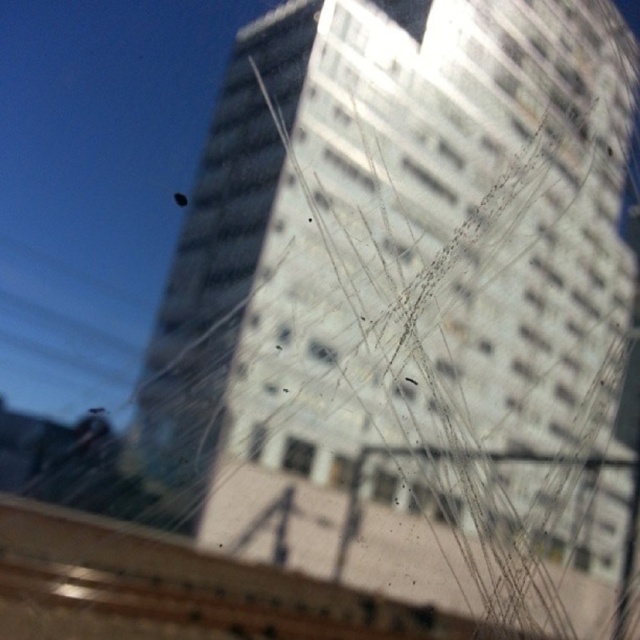
You are an interior designer assessing the view from a room. You notice two types of glass windows at the center of the image. The first is labeled as clear glass window at center, and the second is transparent glass window at center. Which of these two windows allows you to see the tall building behind the streaks more clearly?

The clear glass window at center has a greater height compared to transparent glass window at center, so the clear glass window at center allows you to see the tall building behind the streaks more clearly.

You are trying to see the tall building through the window. Which window allows you to see more of the building? The clear glass window at center or the transparent glass window at center?

The clear glass window at center allows you to see more of the building because it is bigger than the transparent glass window at center.

You are an interior designer trying to choose between two types of windows for a new project. You have the image in front of you and see the clear glass window at center and the transparent glass window at center. Which window is positioned to the left side in the image?

The clear glass window at center is positioned to the left of the transparent glass window at center in the image.